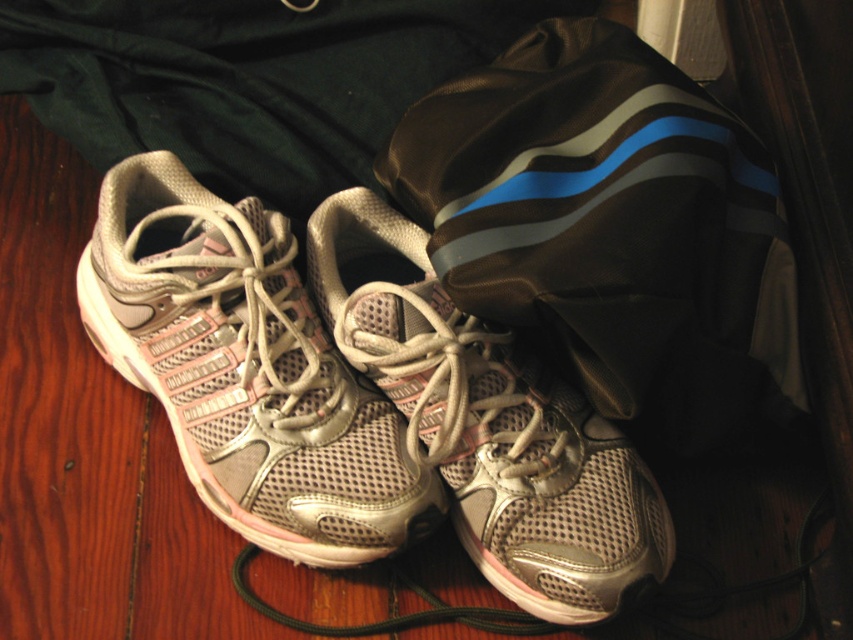
Question: Is silver mesh running shoe at center thinner than metallic mesh shoe at center?

Choices:
 (A) yes
 (B) no

Answer: (B)

Question: Can you confirm if silver mesh running shoe at center is smaller than metallic mesh shoe at center?

Choices:
 (A) no
 (B) yes

Answer: (B)

Question: Does brown fabric bag at center have a larger size compared to metallic mesh shoe at center?

Choices:
 (A) yes
 (B) no

Answer: (A)

Question: Which object is closer to the camera taking this photo?

Choices:
 (A) silver mesh running shoe at center
 (B) brown fabric bag at center
 (C) metallic mesh shoe at center

Answer: (C)

Question: Which point appears closest to the camera in this image?

Choices:
 (A) (495, 129)
 (B) (263, 266)

Answer: (B)

Question: Which of these objects is positioned closest to the silver mesh running shoe at center?

Choices:
 (A) metallic mesh shoe at center
 (B) brown fabric bag at center

Answer: (A)